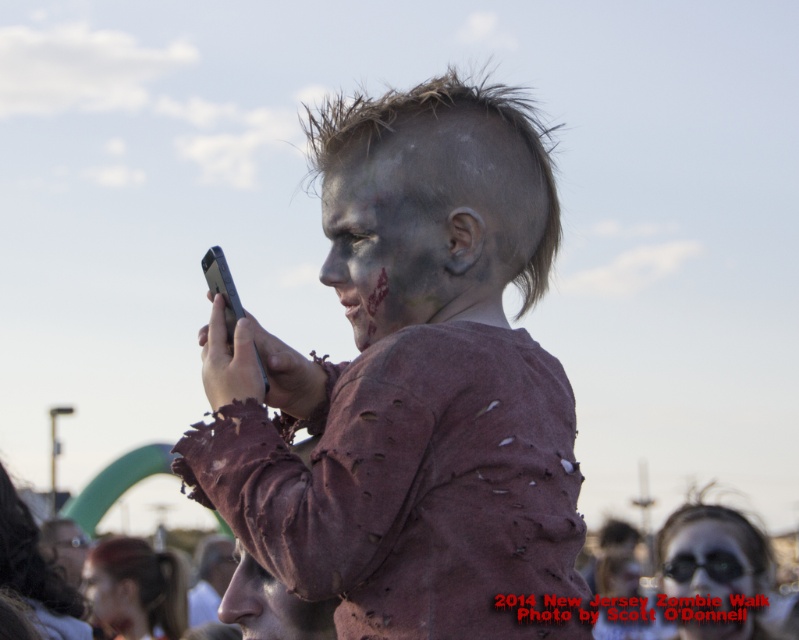
You are a photographer standing 30 meters away from the gray matte face at center. Can you take a clear photo of it with your standard camera lens that has a maximum focusing distance of 30 meters?

The gray matte face at center is 33.74 meters away from the viewer. Since the camera lens can only focus up to 30 meters, you cannot take a clear photo of the gray matte face at center.

You are a photographer at the 2014 New Jersey Zombie Walk. You notice the matte brown shirt at center and the matte gray face paint at center. Which object is positioned higher in the image?

The matte brown shirt at center is located above the matte gray face paint at center, so it is positioned higher in the image.

You are a photographer at the 2014 New Jersey Zombie Walk. You need to position two markers for the zombie performer at coordinates point (340, 262) and point (292, 612). Based on the scene, which point is closer to the camera?

Point (292, 612) is closer to the camera because the Objects Description states that point (340, 262) is behind point (292, 612).